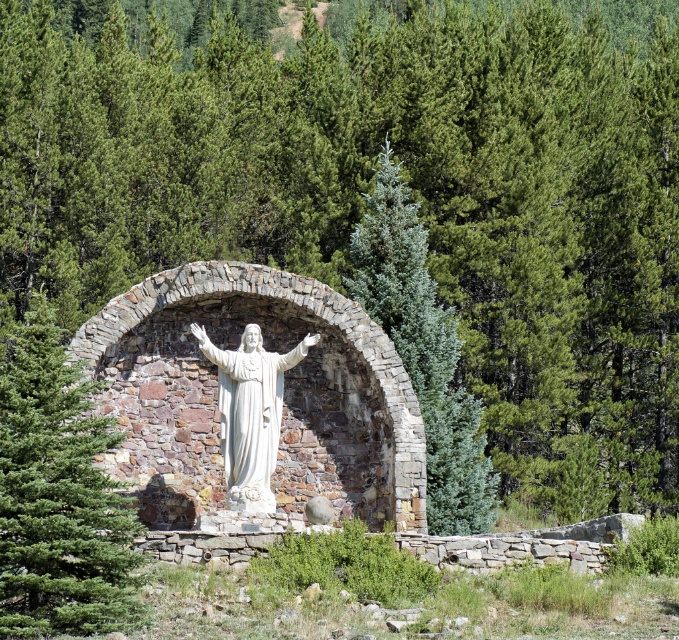
You are an architect designing a garden pathway that needs to pass between the green textured stone arch at center and the green textured pine tree at center. Given that the pathway must be at least 1.2 meters wide, can the space between them accommodate this width?

The green textured stone arch at center is larger than the green textured pine tree at center. However, the exact distance between them isn

You are a landscape architect designing a garden pathway that must pass between the green textured pine tree at center and the white marble statue at center. Considering their heights, which object might require trimming or adjustment to ensure the pathway remains unobstructed for visitors?

The green textured pine tree at center is taller than the white marble statue at center, so it might require trimming to ensure the pathway remains unobstructed for visitors.

You are a photographer planning to take a photo of the white marble statue at center. You notice a green textured pine tree at center in the background. Will the statue be clearly visible in the photo, considering the size of the tree compared to the statue?

The green textured pine tree at center is bigger than the white marble statue at center, so the statue might be partially obscured by the tree, making it less visible in the photo.